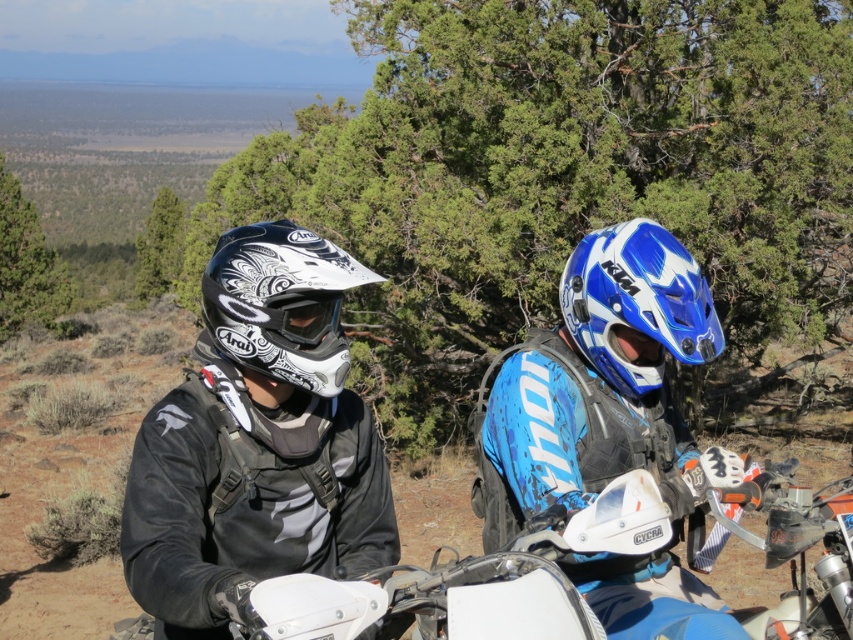
Question: Based on their relative distances, which object is nearer to the matte black helmet at center?

Choices:
 (A) white matte motorcycle at center
 (B) white matte helmet at center
 (C) matte white plastic goggles at center
 (D) blue matte helmet at center

Answer: (B)

Question: Is blue matte helmet at center wider than white matte helmet at center?

Choices:
 (A) no
 (B) yes

Answer: (B)

Question: Is blue matte helmet at center wider than blue glossy helmet at center?

Choices:
 (A) no
 (B) yes

Answer: (B)

Question: Which point appears closest to the camera in this image?

Choices:
 (A) (601, 241)
 (B) (183, 440)

Answer: (B)

Question: Among these objects, which one is nearest to the camera?

Choices:
 (A) blue glossy helmet at center
 (B) white matte motorcycle at center
 (C) matte black helmet at center
 (D) white matte helmet at center

Answer: (C)

Question: Is blue matte helmet at center behind white matte motorcycle at center?

Choices:
 (A) yes
 (B) no

Answer: (B)